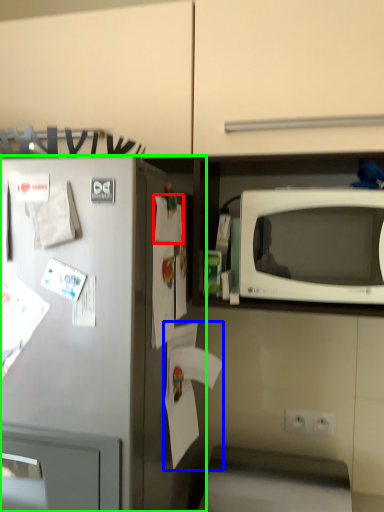
Question: Considering the real-world distances, which object is farthest from paper (highlighted by a red box)? paper (highlighted by a blue box) or refrigerator (highlighted by a green box)?

Choices:
 (A) paper
 (B) refrigerator

Answer: (A)